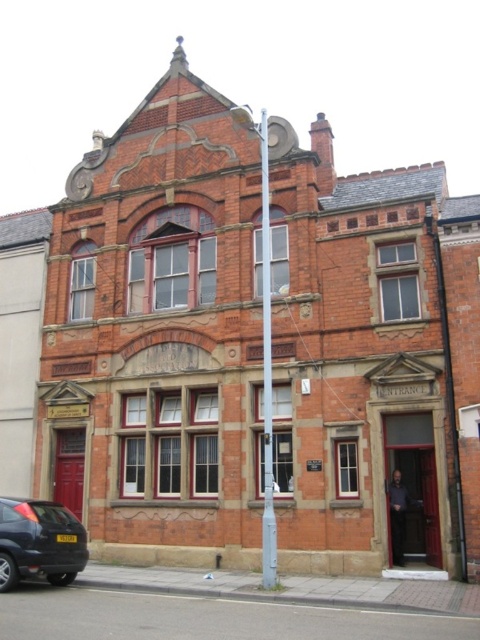
You are a delivery person trying to park your truck next to the matte black car at lower left and the metallic pole at center. Since the truck is 3 meters wide, can you fit it between them?

The matte black car at lower left has a smaller size compared to metallic pole at center, but the exact distance between them is not provided. Therefore, it is impossible to determine if the truck can fit between them based on the given information.

In the scene shown: You are standing at the camera position and want to park your car, which is 15 feet long, as close as possible to the Victorian building without blocking the entrance. The entrance is located directly in front of the central arched window. Is the matte black car at lower left parked too close to the building?

The matte black car at lower left is 102.03 feet from camera. Since the entrance is directly in front of the central arched window and the car is parked 102.03 feet away, it is not too close to block the entrance.